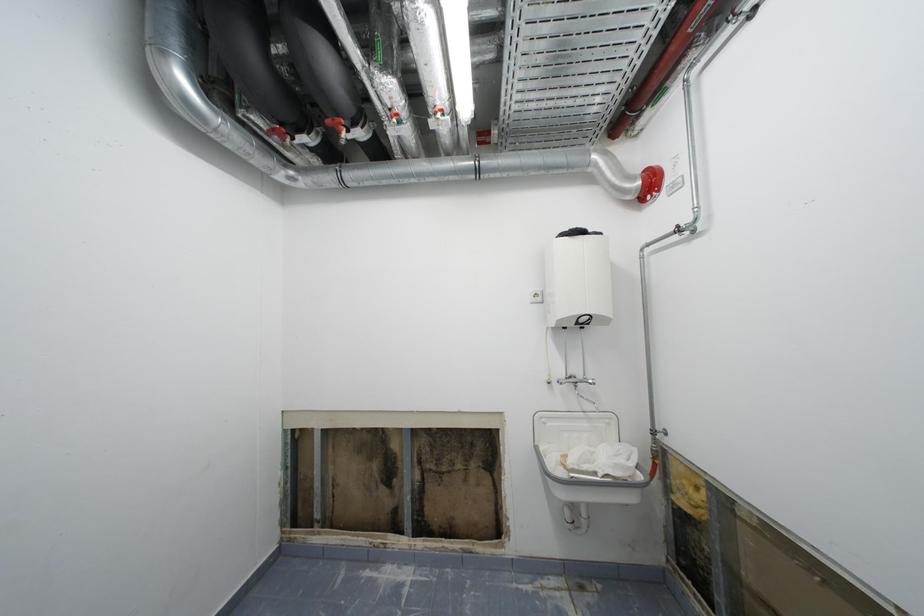
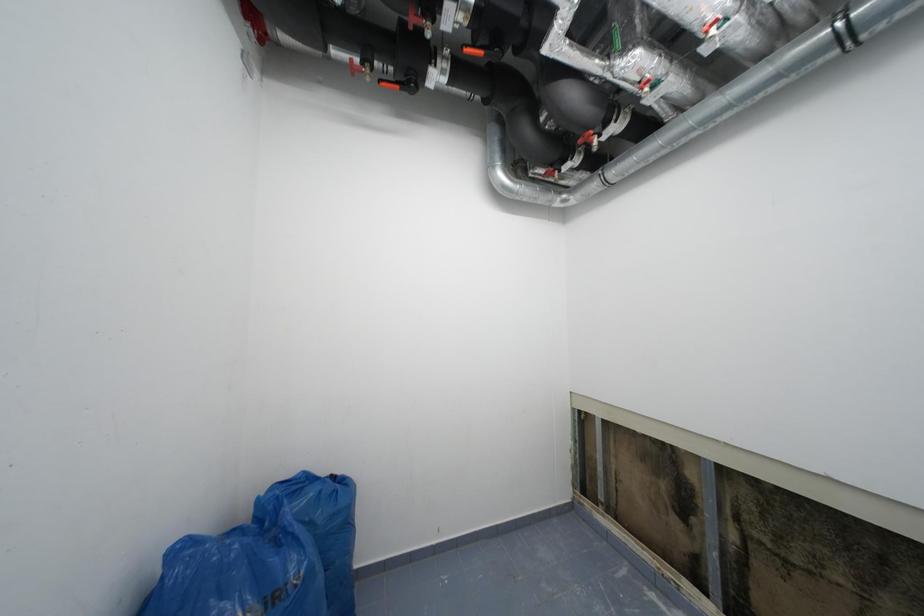
Question: The camera is either moving clockwise (left) or counter-clockwise (right) around the object. The first image is from the beginning of the video and the second image is from the end. Is the camera moving left or right when shooting the video?

Choices:
 (A) Left
 (B) Right

Answer: (B)